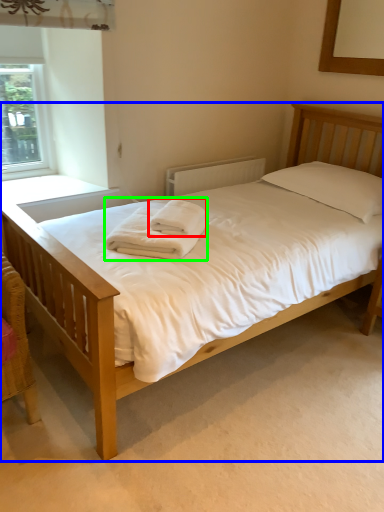
Question: Which object is the closest to the bath towel (highlighted by a red box)? Choose among these: bed (highlighted by a blue box) or bath towel (highlighted by a green box).

Choices:
 (A) bed
 (B) bath towel

Answer: (B)